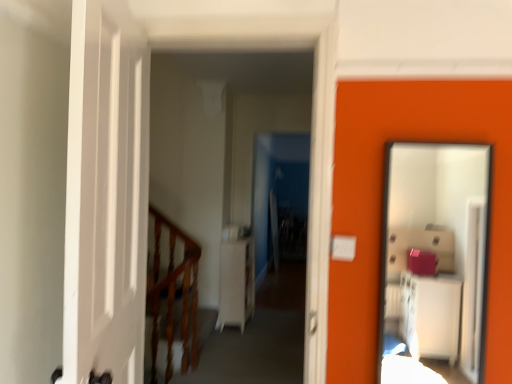
Describe the element at coordinates (435, 252) in the screenshot. I see `smooth glass mirror at right` at that location.

Find the location of a particular element. The image size is (512, 384). white matte dresser at center is located at coordinates (236, 283).

Where is `wooden at left`? wooden at left is located at coordinates (174, 292).

Describe the element at coordinates (174, 292) in the screenshot. I see `wooden at left` at that location.

The height and width of the screenshot is (384, 512). In order to click on smooth glass mirror at right in this screenshot , I will do `click(435, 252)`.

Is smooth glass mirror at right not near wooden at left?

Yes, smooth glass mirror at right and wooden at left are quite far apart.

What's the angular difference between smooth glass mirror at right and wooden at left's facing directions?

The facing directions of smooth glass mirror at right and wooden at left are 88.6 degrees apart.

Considering their positions, is smooth glass mirror at right located in front of or behind wooden at left?

Clearly, smooth glass mirror at right is in front of wooden at left.

From the image's perspective, relative to white matte dresser at center, is white glossy cabinet at center above or below?

white glossy cabinet at center is situated higher than white matte dresser at center in the image.

Looking at this image, is white matte dresser at center completely or partially inside white glossy cabinet at center?

No, white matte dresser at center is located outside of white glossy cabinet at center.

From a real-world perspective, which object rests below the other?

In real-world perspective, white matte dresser at center is lower.

Is white glossy cabinet at center to the left of white matte dresser at center from the viewer's perspective?

In fact, white glossy cabinet at center is to the right of white matte dresser at center.

Is wooden at left positioned behind white glossy cabinet at center?

Yes, it is.

From the image's perspective, is wooden at left beneath white glossy cabinet at center?

Yes, from the image's perspective, wooden at left is below white glossy cabinet at center.

Can you confirm if wooden at left is thinner than white glossy cabinet at center?

Incorrect, the width of wooden at left is not less than that of white glossy cabinet at center.

Would you say wooden at left is a long distance from white glossy cabinet at center?

wooden at left is far away from white glossy cabinet at center.

From a real-world perspective, who is located higher, wooden at left or white matte dresser at center?

wooden at left.

Visually, is wooden at left positioned to the left or to the right of white matte dresser at center?

wooden at left is positioned on white matte dresser at center's left side.

Considering the sizes of wooden at left and white matte dresser at center in the image, is wooden at left taller or shorter than white matte dresser at center?

Clearly, wooden at left is taller compared to white matte dresser at center.

Where is `rail above the white matte dresser at center (from a real-world perspective)`? This screenshot has width=512, height=384. rail above the white matte dresser at center (from a real-world perspective) is located at coordinates (174, 292).

In the image, is smooth glass mirror at right on the left side or the right side of white glossy cabinet at center?

Based on their positions, smooth glass mirror at right is located to the right of white glossy cabinet at center.

Are smooth glass mirror at right and white glossy cabinet at center located far from each other?

smooth glass mirror at right is far away from white glossy cabinet at center.

Can you tell me how much smooth glass mirror at right and white glossy cabinet at center differ in facing direction?

smooth glass mirror at right and white glossy cabinet at center are facing 1 degrees away from each other.

Locate an element on the screen. corridor behind the smooth glass mirror at right is located at coordinates (218, 138).

From the image's perspective, which one is positioned lower, wooden at left or smooth glass mirror at right?

wooden at left is shown below in the image.

Which is behind, wooden at left or smooth glass mirror at right?

wooden at left.

Is wooden at left not close to smooth glass mirror at right?

That's right, there is a large distance between wooden at left and smooth glass mirror at right.

Considering the relative sizes of wooden at left and smooth glass mirror at right in the image provided, is wooden at left bigger than smooth glass mirror at right?

Correct, wooden at left is larger in size than smooth glass mirror at right.

Between white glossy cabinet at center and wooden at left, which one has smaller size?

With smaller size is wooden at left.

Is white glossy cabinet at center looking in the opposite direction of wooden at left?

No, wooden at left is not at the back of white glossy cabinet at center.

From the image's perspective, which one is positioned higher, white glossy cabinet at center or wooden at left?

white glossy cabinet at center is shown above in the image.

Measure the distance between white glossy cabinet at center and wooden at left.

white glossy cabinet at center is 1.16 meters away from wooden at left.

The image size is (512, 384). Identify the location of rail on the left of smooth glass mirror at right. click(174, 292).

Find the location of a particular element. This screenshot has width=512, height=384. corridor above the white matte dresser at center (from the image's perspective) is located at coordinates (218, 138).

When comparing their distances from white glossy cabinet at center, does smooth glass mirror at right or wooden at left seem closer?

Among the two, wooden at left is located nearer to white glossy cabinet at center.

From the image, which object appears to be nearer to wooden at left, white glossy cabinet at center or white matte dresser at center?

white matte dresser at center.

Which object lies further to the anchor point smooth glass mirror at right, white glossy cabinet at center or white matte dresser at center?

Based on the image, white glossy cabinet at center appears to be further to smooth glass mirror at right.

When comparing their distances from white glossy cabinet at center, does smooth glass mirror at right or white matte dresser at center seem further?

smooth glass mirror at right.

Estimate the real-world distances between objects in this image. Which object is closer to wooden at left, white glossy cabinet at center or smooth glass mirror at right?

white glossy cabinet at center is positioned closer to the anchor wooden at left.

Which object lies nearer to the anchor point white glossy cabinet at center, wooden at left or white matte dresser at center?

white matte dresser at center is positioned closer to the anchor white glossy cabinet at center.

Which object lies further to the anchor point wooden at left, smooth glass mirror at right or white matte dresser at center?

smooth glass mirror at right.

When comparing their distances from white glossy cabinet at center, does white matte dresser at center or wooden at left seem closer?

The object closer to white glossy cabinet at center is white matte dresser at center.

What are the coordinates of `rail between white glossy cabinet at center and white matte dresser at center in the front-back direction` in the screenshot? It's located at pos(174,292).

Identify the location of rail between smooth glass mirror at right and white matte dresser at center in the front-back direction. (174, 292).

Identify the location of corridor positioned between smooth glass mirror at right and white matte dresser at center from near to far. This screenshot has height=384, width=512. pos(218,138).

The height and width of the screenshot is (384, 512). Find the location of `corridor positioned between smooth glass mirror at right and wooden at left from near to far`. corridor positioned between smooth glass mirror at right and wooden at left from near to far is located at coordinates (218, 138).